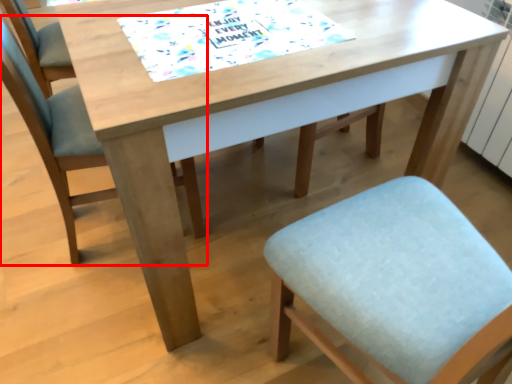
Question: Considering the relative positions of chair (annotated by the red box) and place mat in the image provided, where is chair (annotated by the red box) located with respect to the staircase?

Choices:
 (A) right
 (B) left

Answer: (B)